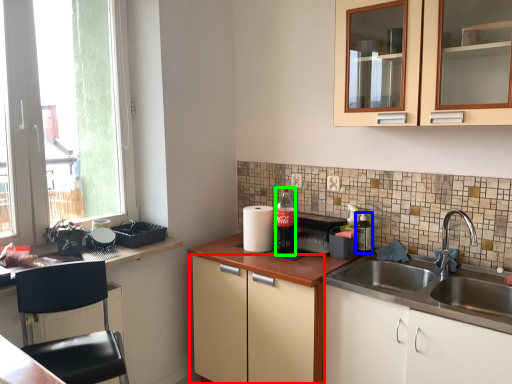
Question: Estimate the real-world distances between objects in this image. Which object is farther from cabinetry (highlighted by a red box), bottle (highlighted by a blue box) or bottle (highlighted by a green box)?

Choices:
 (A) bottle
 (B) bottle

Answer: (A)